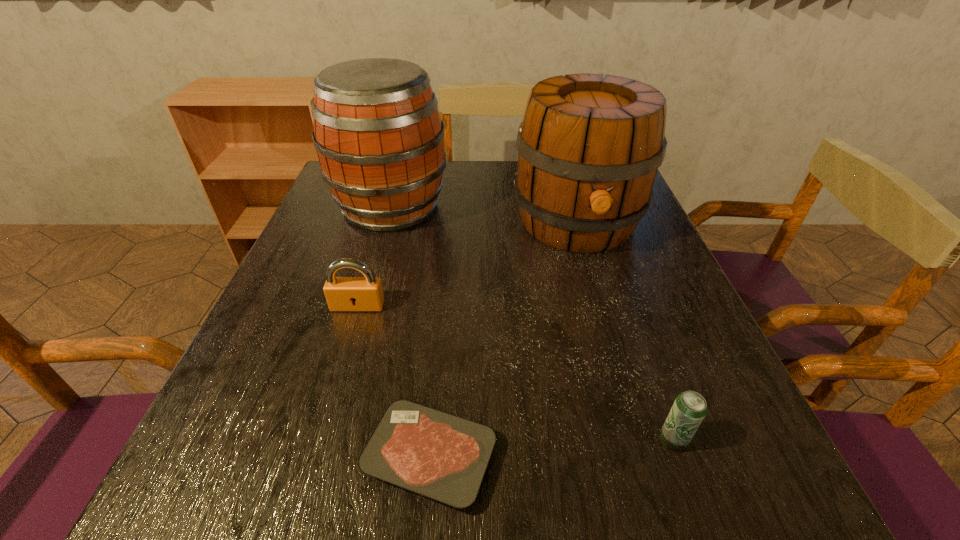
At what (x,y) coordinates should I click in order to perform the action: click on free space located on the back of the shortest object. Please return your answer as a coordinate pair (x, y). The width and height of the screenshot is (960, 540). Looking at the image, I should click on (444, 305).

Find the location of a particular element. object that is at the near edge is located at coordinates (439, 455).

Locate an element on the screen. cider that is at the left edge is located at coordinates (379, 137).

Where is `padlock located at the left edge`? This screenshot has width=960, height=540. padlock located at the left edge is located at coordinates (365, 293).

This screenshot has height=540, width=960. I want to click on cider located at the right edge, so click(x=589, y=148).

Where is `beer can situated at the right edge`? This screenshot has width=960, height=540. beer can situated at the right edge is located at coordinates (689, 409).

Locate an element on the screen. This screenshot has height=540, width=960. object that is positioned at the far left corner is located at coordinates (379, 137).

Where is `object that is at the far right corner`? This screenshot has height=540, width=960. object that is at the far right corner is located at coordinates (589, 148).

This screenshot has width=960, height=540. In order to click on vacant space at the far edge of the desktop in this screenshot , I will do pos(467,173).

The width and height of the screenshot is (960, 540). What are the coordinates of `free point at the near edge` in the screenshot? It's located at (630, 475).